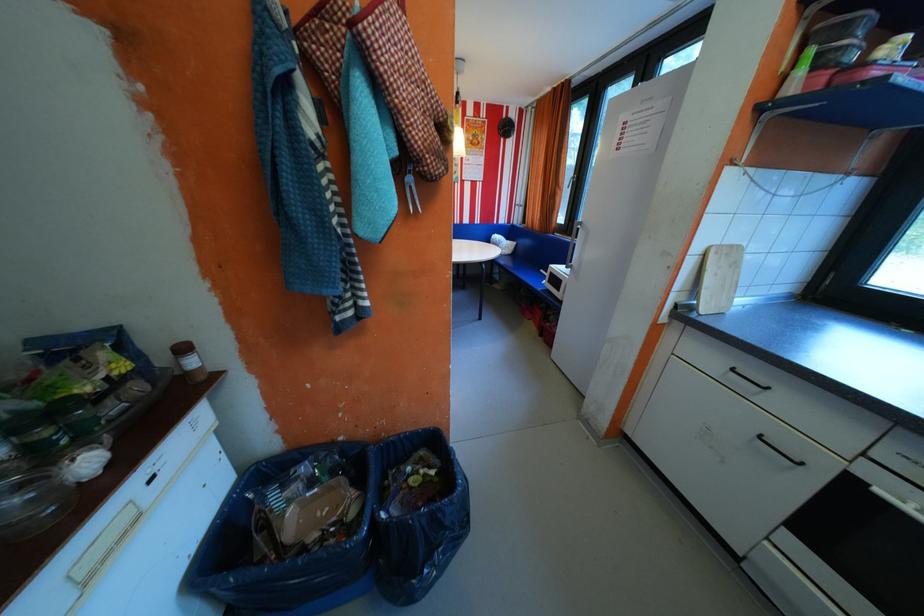
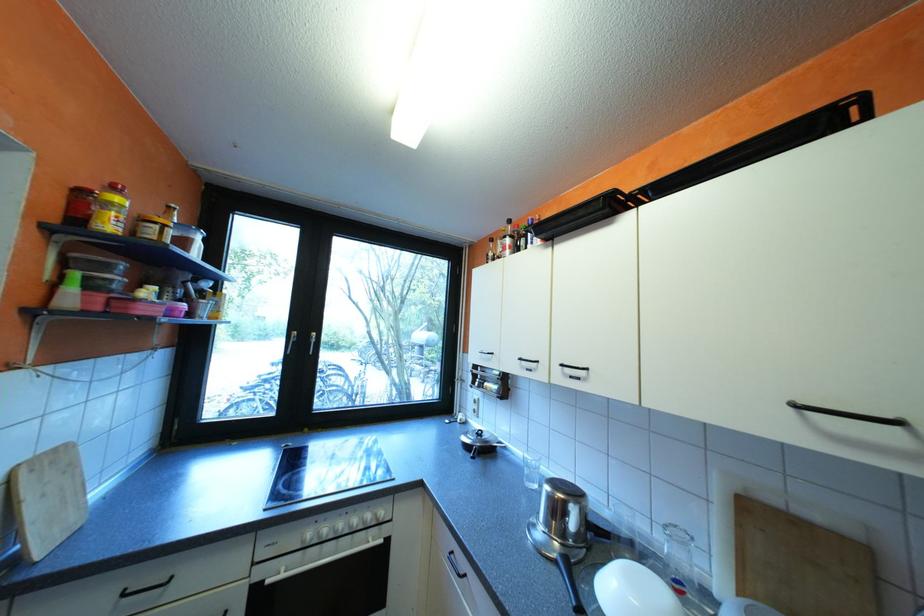
Find the pixel in the second image that matches point (716, 254) in the first image.

(20, 482)